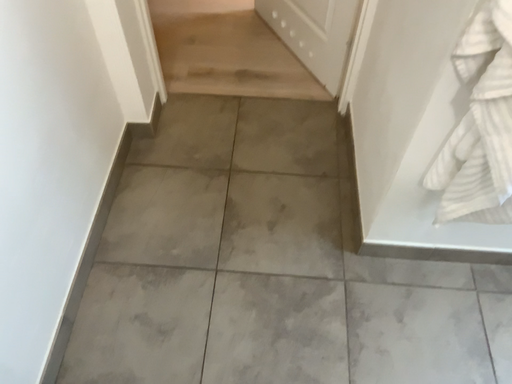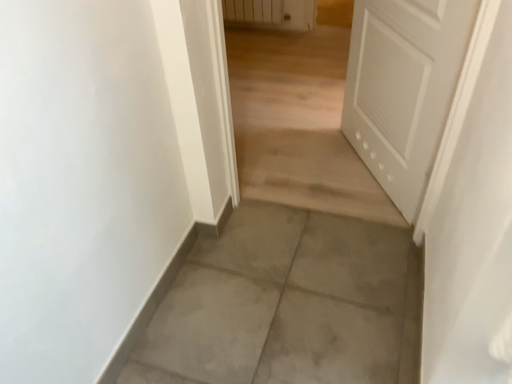
Question: Which way did the camera rotate in the video?

Choices:
 (A) rotated upward
 (B) rotated downward

Answer: (A)